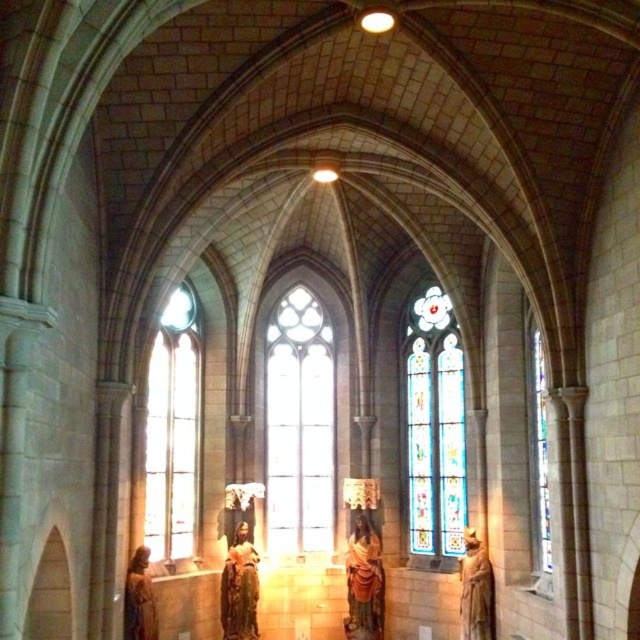
You are an art student visiting the church and want to sketch both the golden statue at center and the matte gold statue at lower left. Which statue should you focus on first if you want to draw the taller one?

The golden statue at center is taller than the matte gold statue at lower left, so you should focus on the golden statue at center first.

You are standing in the grand historic church and want to locate the wooden statue at center. Based on the coordinates provided in the image, where would you find the point at (364, 582)?

The point at (364, 582) is located on the wooden statue at center.

You are an architect analyzing the church layout. You notice the stained glass window at center and the clear glass window at left. Which window is located higher up in the church structure?

The clear glass window at left is located higher up because the stained glass window at center is positioned under it.